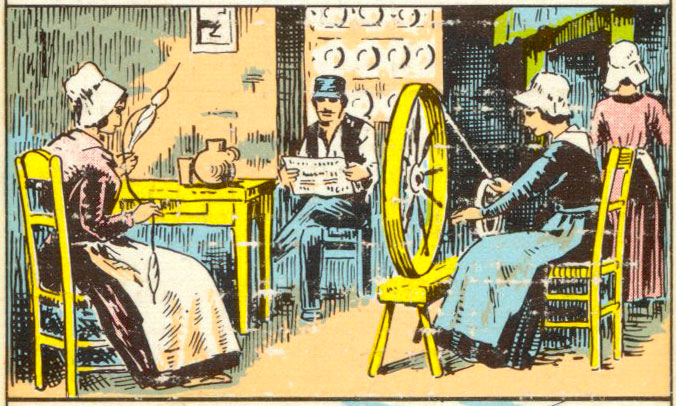
Where is `floor`? floor is located at coordinates (500, 384).